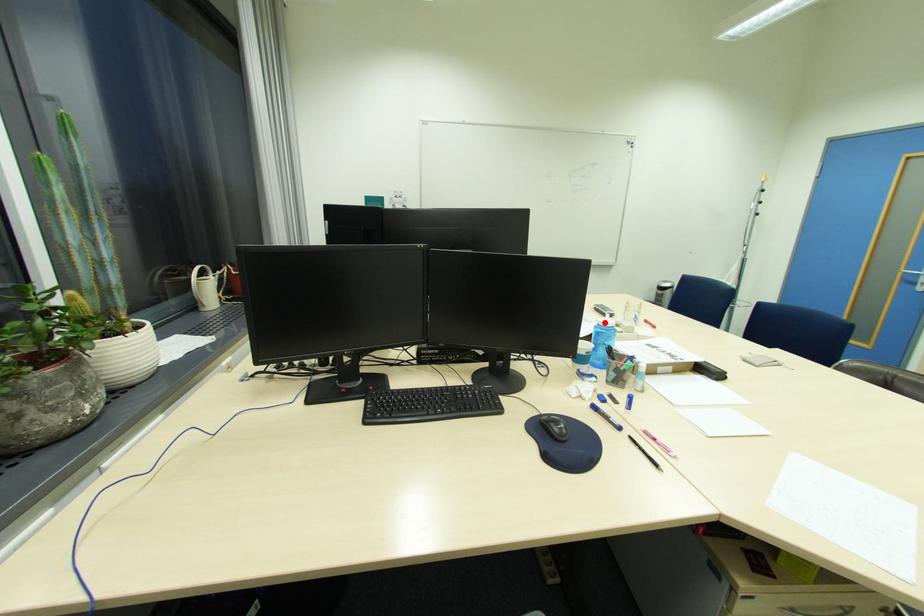
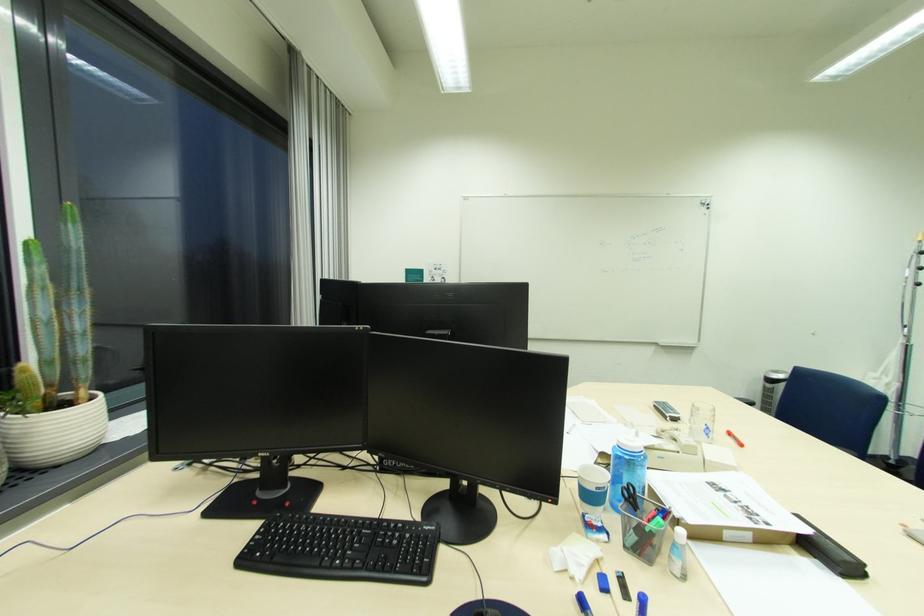
Question: I am providing you with two images of the same scene from different viewpoints. A red point is marked on the first image. Can you still see the location of the red point in image 2?

Choices:
 (A) Yes
 (B) No

Answer: (A)